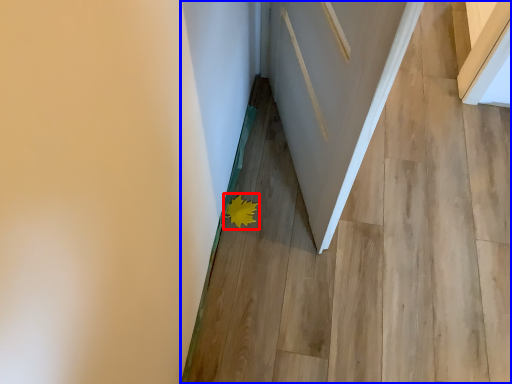
Question: Which point is closer to the camera, flower (highlighted by a red box) or stairwell (highlighted by a blue box)?

Choices:
 (A) flower
 (B) stairwell

Answer: (B)